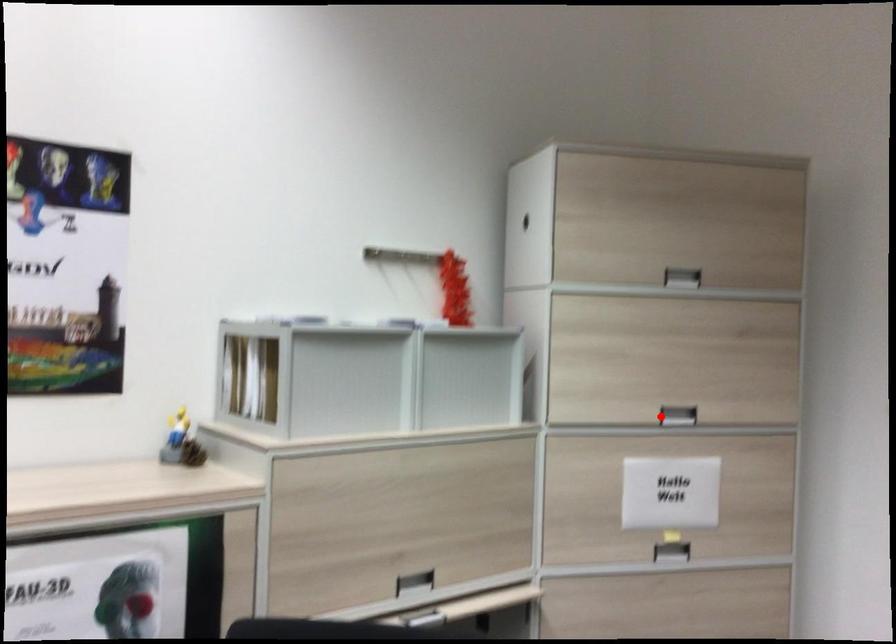
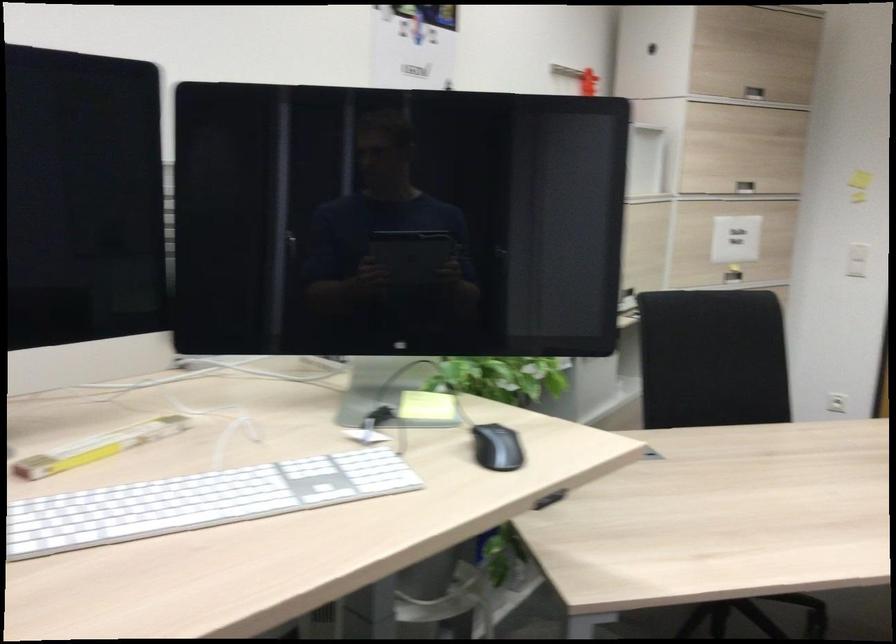
Find the pixel in the second image that matches the highlighted location in the first image.

(745, 187)